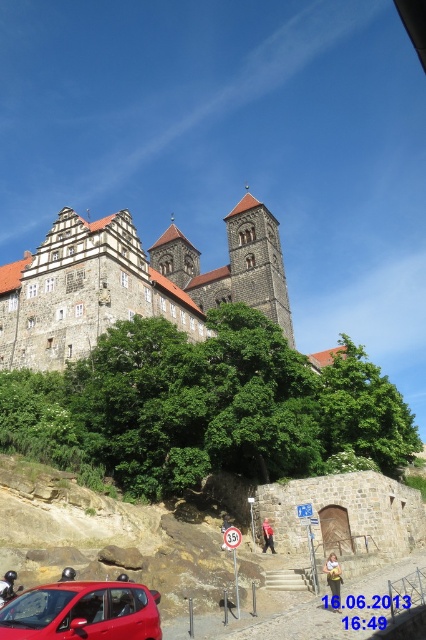
Question: Can you confirm if stone castle at upper center is positioned below brown stone tower at center?

Choices:
 (A) no
 (B) yes

Answer: (A)

Question: Which point is closer to the camera?

Choices:
 (A) stone castle at upper center
 (B) shiny red car at lower left
 (C) brown stone tower at center

Answer: (B)

Question: Which point is closer to the camera taking this photo?

Choices:
 (A) (120, 214)
 (B) (109, 636)
 (C) (282, 291)

Answer: (B)

Question: Is stone castle at upper center positioned at the back of shiny red car at lower left?

Choices:
 (A) yes
 (B) no

Answer: (A)

Question: Which of the following is the farthest from the observer?

Choices:
 (A) (x=279, y=317)
 (B) (x=48, y=596)
 (C) (x=161, y=316)

Answer: (A)

Question: Is shiny red car at lower left behind brown stone tower at center?

Choices:
 (A) yes
 (B) no

Answer: (B)